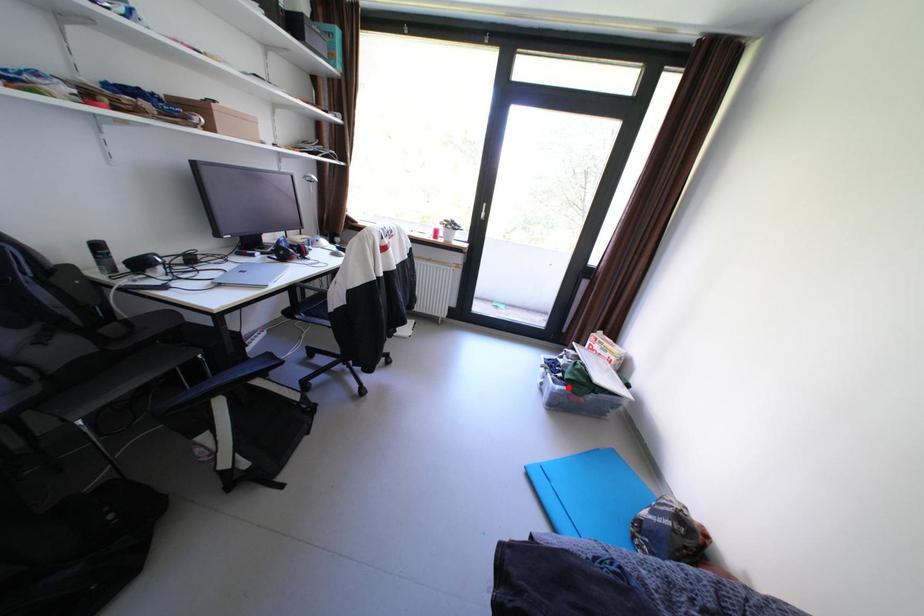
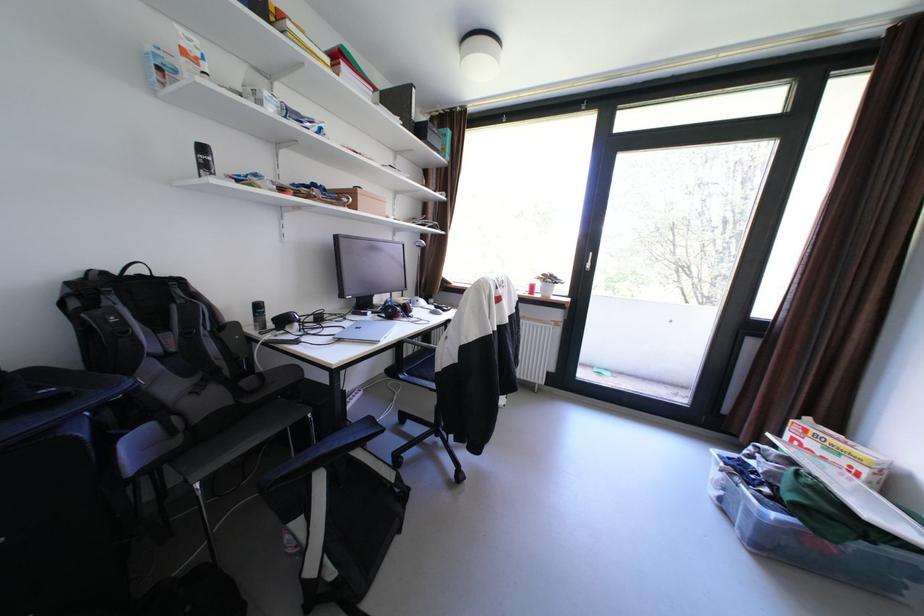
Where in the second image is the point corresponding to the highlighted location from the first image?

(784, 516)